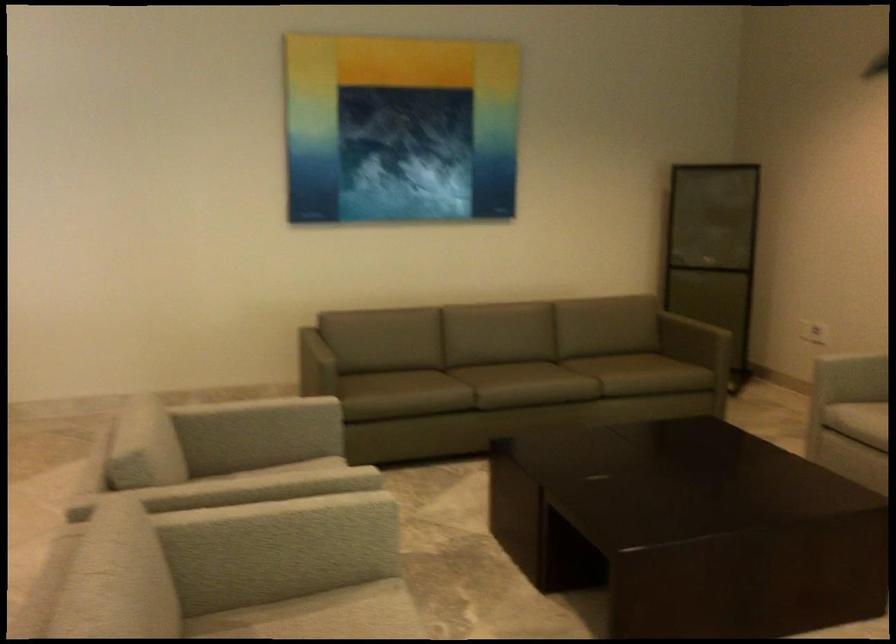
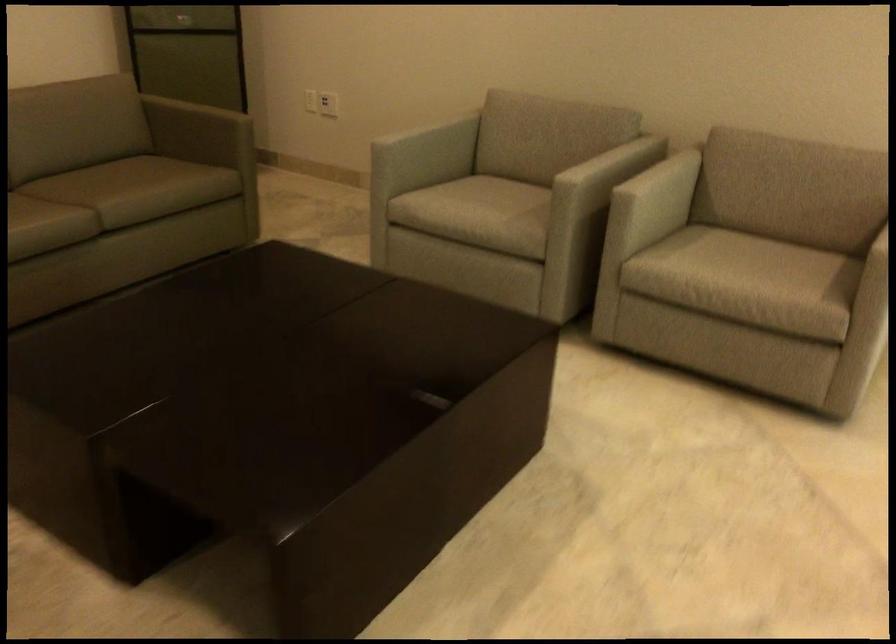
Find the pixel in the second image that matches the point at 797,333 in the first image.

(328, 104)